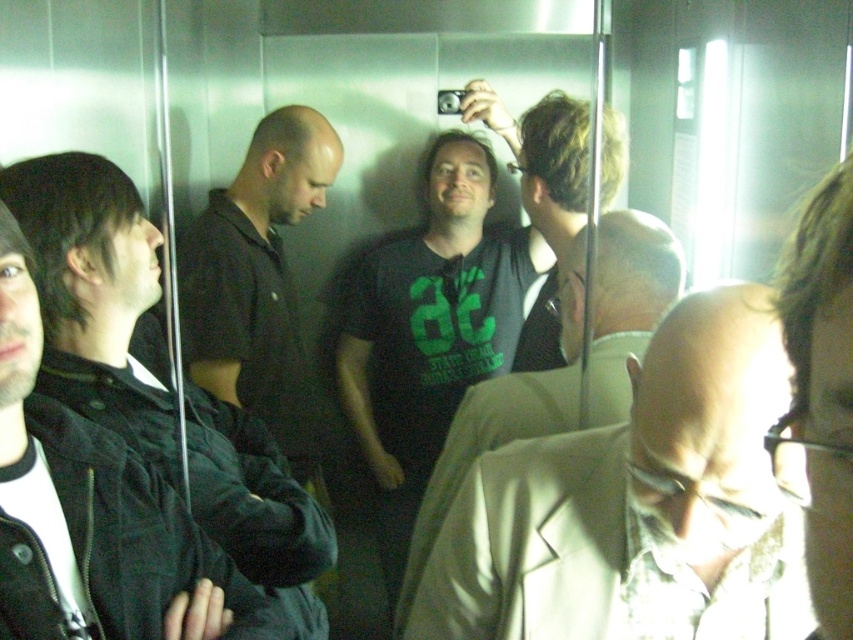
Question: Which point appears closest to the camera in this image?

Choices:
 (A) (466, 512)
 (B) (291, 365)
 (C) (259, 436)
 (D) (351, 420)

Answer: (A)

Question: Is light beige suit at center to the right of dark green t-shirt at center from the viewer's perspective?

Choices:
 (A) no
 (B) yes

Answer: (B)

Question: Among these objects, which one is nearest to the camera?

Choices:
 (A) light beige suit at center
 (B) black quilted jacket at left

Answer: (A)

Question: Is dark green t-shirt at center to the right of black matte shirt at left from the viewer's perspective?

Choices:
 (A) no
 (B) yes

Answer: (B)

Question: Which point is closer to the camera taking this photo?

Choices:
 (A) (448, 401)
 (B) (218, 488)
 (C) (733, 624)

Answer: (C)

Question: Is dark green t-shirt at center below dark brown hair at upper right?

Choices:
 (A) yes
 (B) no

Answer: (B)